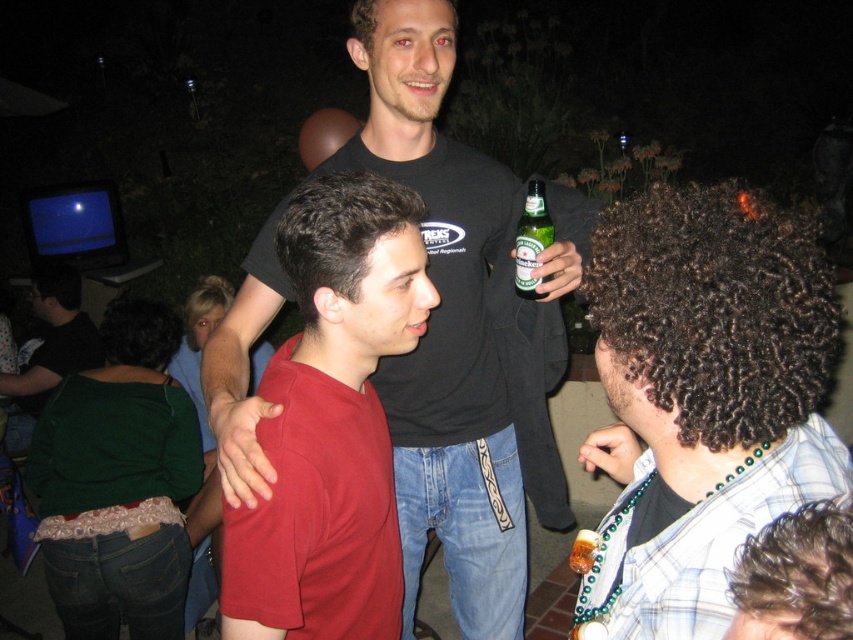
Is matte black shirt at center to the right of matte red shirt at center from the viewer's perspective?

Correct, you'll find matte black shirt at center to the right of matte red shirt at center.

Which of these two, matte black shirt at center or matte red shirt at center, stands taller?

matte black shirt at center

Which is behind, point (467, 337) or point (335, 608)?

The point (467, 337) is more distant.

Image resolution: width=853 pixels, height=640 pixels. Find the location of `matte black shirt at center`. matte black shirt at center is located at coordinates (463, 330).

Is green glass bottle at center positioned before translucent glass bottle at center?

That is False.

Can you confirm if green glass bottle at center is thinner than translucent glass bottle at center?

Incorrect, green glass bottle at center's width is not less than translucent glass bottle at center's.

Is point (552, 240) positioned after point (587, 556)?

Yes, point (552, 240) is behind point (587, 556).

Where is `green glass bottle at center`? green glass bottle at center is located at coordinates (531, 237).

Can you confirm if matte black shirt at center is wider than green glass bottle at center?

Correct, the width of matte black shirt at center exceeds that of green glass bottle at center.

Which is below, matte black shirt at center or green glass bottle at center?

matte black shirt at center

Image resolution: width=853 pixels, height=640 pixels. Identify the location of matte black shirt at center. (463, 330).